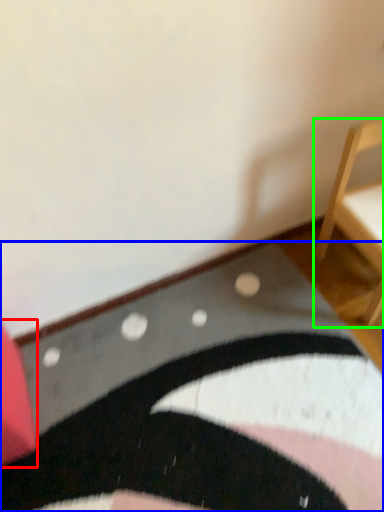
Question: Based on their relative distances, which object is farther from furniture (highlighted by a red box)? Choose from mat (highlighted by a blue box) and furniture (highlighted by a green box).

Choices:
 (A) mat
 (B) furniture

Answer: (B)